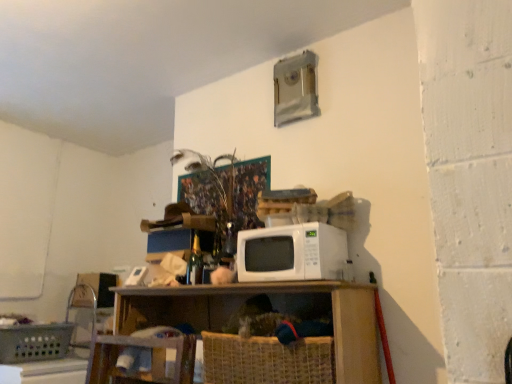
This screenshot has width=512, height=384. I want to click on wooden shelf at center, so click(280, 308).

How much space does plastic woven basket at lower left, marked as the 2th basket in a front-to-back arrangement, occupy vertically?

The height of plastic woven basket at lower left, marked as the 2th basket in a front-to-back arrangement, is 28.98 centimeters.

Where is `wooden shelf at center`? wooden shelf at center is located at coordinates (280, 308).

Considering the relative sizes of wooden shelf at center and white matte microwave at center in the image provided, is wooden shelf at center taller than white matte microwave at center?

Indeed, wooden shelf at center has a greater height compared to white matte microwave at center.

Is wooden shelf at center turned away from white matte microwave at center?

No.

Considering the relative sizes of wooden shelf at center and white matte microwave at center in the image provided, is wooden shelf at center wider than white matte microwave at center?

Correct, the width of wooden shelf at center exceeds that of white matte microwave at center.

In the scene shown: From the image's perspective, which object appears higher, wooden shelf at center or white matte microwave at center?

white matte microwave at center appears higher in the image.

Between wooden shelf at center and woven straw basket at lower center, the second basket positioned from the left, which one appears on the right side from the viewer's perspective?

woven straw basket at lower center, the second basket positioned from the left.

Is woven straw basket at lower center, the 1th basket positioned from the front, at the back of wooden shelf at center?

Yes, wooden shelf at center is facing away from woven straw basket at lower center, the 1th basket positioned from the front.

From a real-world perspective, is wooden shelf at center positioned under woven straw basket at lower center, marked as the first basket in a right-to-left arrangement, based on gravity?

Incorrect, from a real-world perspective, wooden shelf at center is higher than woven straw basket at lower center, marked as the first basket in a right-to-left arrangement.

Does point (345, 351) come in front of point (275, 363)?

Yes, point (345, 351) is in front of point (275, 363).

Between wooden swivel chair at lower left and woven straw basket at lower center, placed as the 2th basket when sorted from back to front, which one has larger size?

woven straw basket at lower center, placed as the 2th basket when sorted from back to front, is bigger.

Is wooden swivel chair at lower left placed right next to woven straw basket at lower center, the second basket positioned from the left?

There is a gap between wooden swivel chair at lower left and woven straw basket at lower center, the second basket positioned from the left.

Considering the points (173, 342) and (221, 369), which point is behind, point (173, 342) or point (221, 369)?

The point (173, 342) is farther from the camera.

Is wooden swivel chair at lower left taller or shorter than woven straw basket at lower center, placed as the 2th basket when sorted from back to front?

Considering their sizes, wooden swivel chair at lower left has more height than woven straw basket at lower center, placed as the 2th basket when sorted from back to front.

From the image's perspective, is woven straw basket at lower center, marked as the first basket in a right-to-left arrangement, located above wooden swivel chair at lower left?

Indeed, from the image's perspective, woven straw basket at lower center, marked as the first basket in a right-to-left arrangement, is shown above wooden swivel chair at lower left.

Considering the sizes of woven straw basket at lower center, the second basket positioned from the left, and wooden swivel chair at lower left in the image, is woven straw basket at lower center, the second basket positioned from the left, wider or thinner than wooden swivel chair at lower left?

Clearly, woven straw basket at lower center, the second basket positioned from the left, has less width compared to wooden swivel chair at lower left.

Identify the location of basket that appears below the wooden swivel chair at lower left (from a real-world perspective). (266, 360).

Is woven straw basket at lower center, the second basket positioned from the left, far away from wooden swivel chair at lower left?

No, woven straw basket at lower center, the second basket positioned from the left, is in close proximity to wooden swivel chair at lower left.

Based on their sizes in the image, would you say white matte microwave at center is bigger or smaller than wooden swivel chair at lower left?

white matte microwave at center is smaller than wooden swivel chair at lower left.

Does white matte microwave at center have a lesser height compared to wooden swivel chair at lower left?

Yes.

Is white matte microwave at center directly adjacent to wooden swivel chair at lower left?

No, white matte microwave at center is not next to wooden swivel chair at lower left.

Is white matte microwave at center situated inside wooden swivel chair at lower left or outside?

white matte microwave at center is outside wooden swivel chair at lower left.

How distant is wooden swivel chair at lower left from wooden shelf at center?

They are 14.39 inches apart.

In the image, is wooden swivel chair at lower left positioned in front of or behind wooden shelf at center?

wooden swivel chair at lower left is positioned farther from the viewer than wooden shelf at center.

Is wooden swivel chair at lower left with wooden shelf at center?

They are not placed beside each other.

Does wooden swivel chair at lower left turn towards wooden shelf at center?

Yes, wooden swivel chair at lower left is aimed at wooden shelf at center.

How far apart are wooden swivel chair at lower left and plastic woven basket at lower left, which ranks as the 1th basket in left-to-right order?

wooden swivel chair at lower left and plastic woven basket at lower left, which ranks as the 1th basket in left-to-right order, are 37.76 inches apart from each other.

Considering the positions of point (161, 339) and point (40, 339), is point (161, 339) closer or farther from the camera than point (40, 339)?

Point (161, 339).

Which of these two, wooden swivel chair at lower left or plastic woven basket at lower left, marked as the 2th basket in a front-to-back arrangement, stands shorter?

With less height is plastic woven basket at lower left, marked as the 2th basket in a front-to-back arrangement.

Is wooden swivel chair at lower left next to plastic woven basket at lower left, which ranks as the 1th basket in left-to-right order, and touching it?

No.

Locate an element on the screen. microwave oven lying above the wooden shelf at center (from the image's perspective) is located at coordinates (293, 253).

Image resolution: width=512 pixels, height=384 pixels. Find the location of `basket located on the right of wooden shelf at center`. basket located on the right of wooden shelf at center is located at coordinates click(266, 360).

Which object lies further to the anchor point plastic woven basket at lower left, which ranks as the 1th basket in left-to-right order, white matte microwave at center or wooden shelf at center?

white matte microwave at center lies further to plastic woven basket at lower left, which ranks as the 1th basket in left-to-right order, than the other object.

Considering their positions, is wooden shelf at center positioned closer to plastic woven basket at lower left, marked as the 2th basket in a front-to-back arrangement, than wooden swivel chair at lower left?

wooden swivel chair at lower left is closer to plastic woven basket at lower left, marked as the 2th basket in a front-to-back arrangement.

Based on their spatial positions, is woven straw basket at lower center, marked as the first basket in a right-to-left arrangement, or wooden swivel chair at lower left closer to white matte microwave at center?

Based on the image, woven straw basket at lower center, marked as the first basket in a right-to-left arrangement, appears to be nearer to white matte microwave at center.

From the image, which object appears to be nearer to woven straw basket at lower center, the second basket positioned from the left, plastic woven basket at lower left, marked as the 2th basket in a front-to-back arrangement, or white matte microwave at center?

white matte microwave at center.

When comparing their distances from wooden swivel chair at lower left, does woven straw basket at lower center, placed as the 2th basket when sorted from back to front, or plastic woven basket at lower left, the first basket viewed from the back, seem closer?

woven straw basket at lower center, placed as the 2th basket when sorted from back to front, is closer to wooden swivel chair at lower left.

Estimate the real-world distances between objects in this image. Which object is further from wooden shelf at center, woven straw basket at lower center, the second basket positioned from the left, or white matte microwave at center?

woven straw basket at lower center, the second basket positioned from the left.

Based on their spatial positions, is woven straw basket at lower center, the 1th basket positioned from the front, or wooden shelf at center further from wooden swivel chair at lower left?

woven straw basket at lower center, the 1th basket positioned from the front.

Which object lies nearer to the anchor point woven straw basket at lower center, placed as the 2th basket when sorted from back to front, white matte microwave at center or wooden swivel chair at lower left?

wooden swivel chair at lower left lies closer to woven straw basket at lower center, placed as the 2th basket when sorted from back to front, than the other object.

Identify the location of shelf between plastic woven basket at lower left, which ranks as the 1th basket in left-to-right order, and white matte microwave at center, in the horizontal direction. (280, 308).

I want to click on shelf between wooden swivel chair at lower left and white matte microwave at center in the horizontal direction, so click(x=280, y=308).

Where is `shelf situated between plastic woven basket at lower left, marked as the 2th basket in a front-to-back arrangement, and woven straw basket at lower center, marked as the first basket in a right-to-left arrangement, from left to right`? This screenshot has height=384, width=512. shelf situated between plastic woven basket at lower left, marked as the 2th basket in a front-to-back arrangement, and woven straw basket at lower center, marked as the first basket in a right-to-left arrangement, from left to right is located at coordinates (280, 308).

I want to click on swivel chair situated between plastic woven basket at lower left, the first basket viewed from the back, and wooden shelf at center from left to right, so click(138, 369).